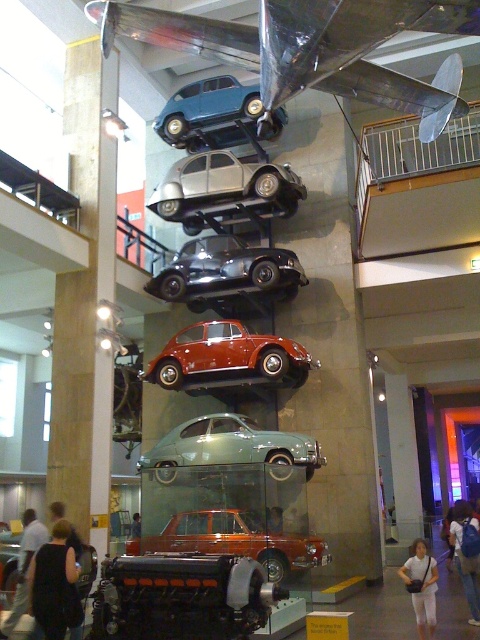
Is black fabric dress at lower left taller than denim jacket at lower right?

Indeed, black fabric dress at lower left has a greater height compared to denim jacket at lower right.

Who is positioned more to the left, black fabric dress at lower left or denim jacket at lower right?

black fabric dress at lower left

Is point (37, 572) farther from viewer compared to point (452, 531)?

No, (37, 572) is in front of (452, 531).

Where is `black fabric dress at lower left`? This screenshot has height=640, width=480. black fabric dress at lower left is located at coordinates (52, 580).

Does shiny orange car at center have a larger size compared to smooth brown leather jacket at center?

Indeed, shiny orange car at center has a larger size compared to smooth brown leather jacket at center.

Can you confirm if shiny orange car at center is thinner than smooth brown leather jacket at center?

No.

Is point (226, 536) positioned behind point (282, 509)?

No, (226, 536) is in front of (282, 509).

You are a GUI agent. You are given a task and a screenshot of the screen. Output one action in this format:
    pyautogui.click(x=<x>, y=<y>)
    Task: Click on the shiny orange car at center
    The width and height of the screenshot is (480, 640).
    Given the screenshot: What is the action you would take?
    pyautogui.click(x=235, y=540)

Does matte blue car at upper center have a lesser width compared to light brown leather jacket at lower center?

Incorrect, matte blue car at upper center's width is not less than light brown leather jacket at lower center's.

Between matte blue car at upper center and light brown leather jacket at lower center, which one is positioned lower?

Positioned lower is light brown leather jacket at lower center.

Is point (160, 115) farther from viewer compared to point (136, 515)?

No, (160, 115) is in front of (136, 515).

Image resolution: width=480 pixels, height=640 pixels. Identify the location of matte blue car at upper center. (210, 115).